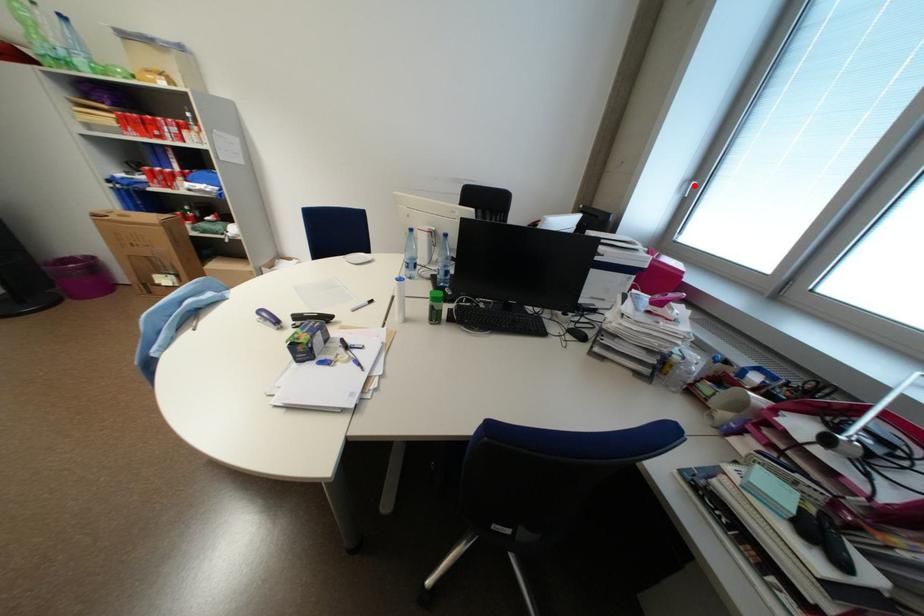
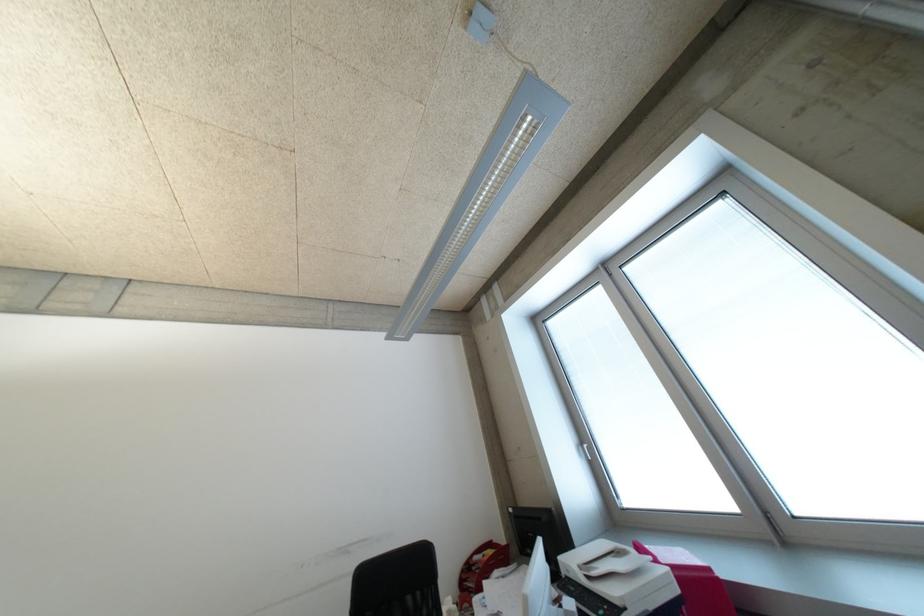
Locate, in the second image, the point that corresponds to the highlighted location in the first image.

(589, 450)